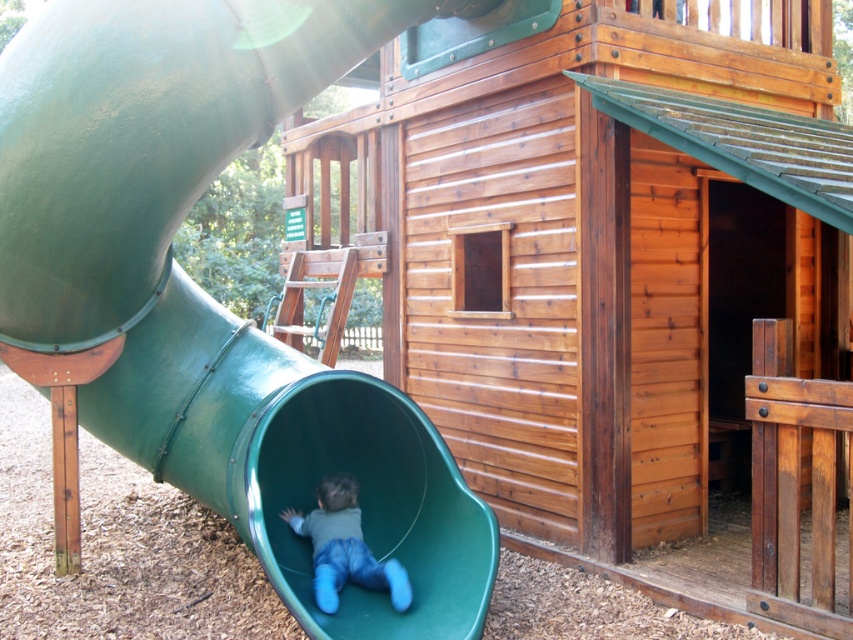
Can you confirm if wooden cabin at center is taller than matte green slide at lower left?

Indeed, wooden cabin at center has a greater height compared to matte green slide at lower left.

Which is more to the left, wooden cabin at center or matte green slide at lower left?

From the viewer's perspective, matte green slide at lower left appears more on the left side.

Which is in front, point (790, 36) or point (352, 577)?

Point (352, 577)

Identify the location of wooden cabin at center. The height and width of the screenshot is (640, 853). (585, 244).

Does wooden cabin at center appear on the right side of green rubber slide at left?

Correct, you'll find wooden cabin at center to the right of green rubber slide at left.

Between wooden cabin at center and green rubber slide at left, which one appears on the right side from the viewer's perspective?

Positioned to the right is wooden cabin at center.

Does point (554, 449) lie in front of point (25, 90)?

No, (554, 449) is further to viewer.

Locate an element on the screen. The width and height of the screenshot is (853, 640). wooden cabin at center is located at coordinates (585, 244).

Which of these two, green rubber slide at left or matte green slide at lower left, stands shorter?

matte green slide at lower left is shorter.

Does green rubber slide at left appear on the left side of matte green slide at lower left?

Yes, green rubber slide at left is to the left of matte green slide at lower left.

Is point (279, 93) positioned behind point (318, 506)?

No, (279, 93) is in front of (318, 506).

The height and width of the screenshot is (640, 853). Identify the location of green rubber slide at left. (207, 294).